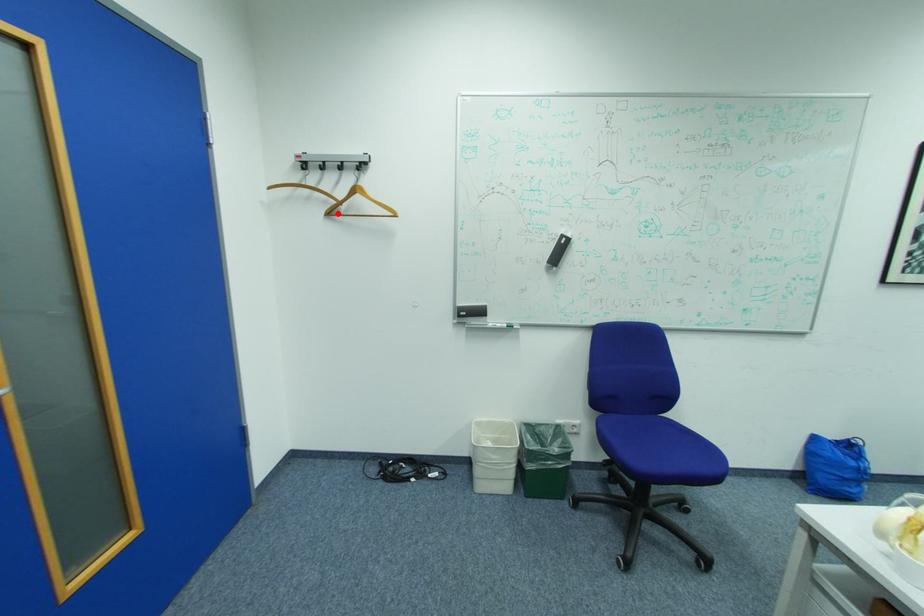
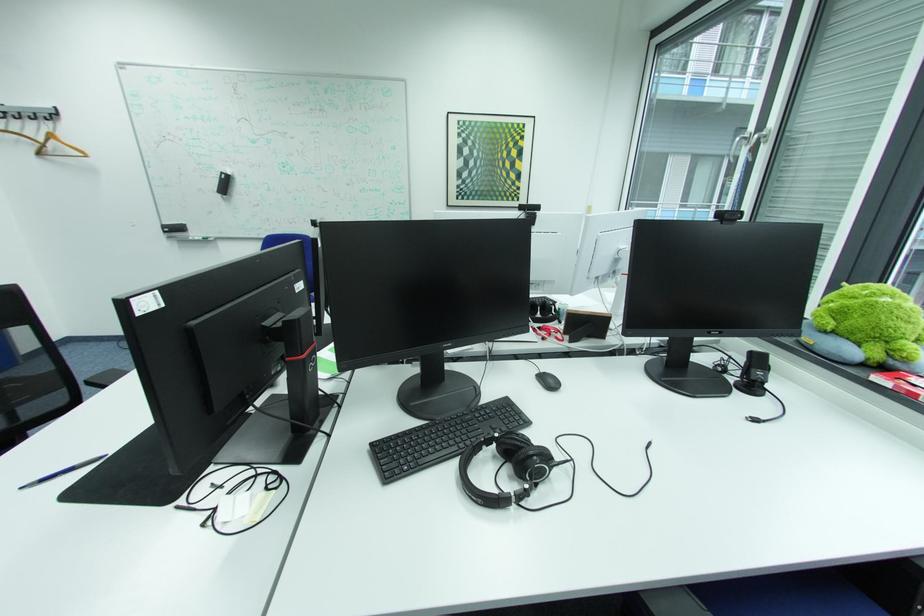
Question: I am providing you with two images of the same scene from different viewpoints. A red point is shown in image1. For the corresponding object point in image2, is it positioned nearer or farther from the camera?

Choices:
 (A) Nearer
 (B) Farther

Answer: (B)